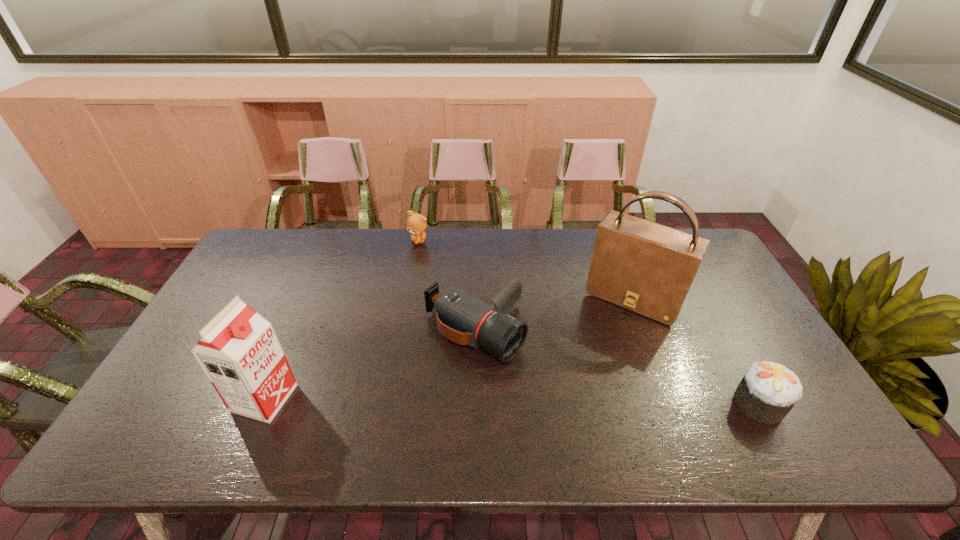
Locate an element on the screen. vacant space on the desktop that is between the soya milk and the rightmost object and is positioned on the face of the fourth object from right to left is located at coordinates (468, 400).

I want to click on vacant space on the desktop that is between the soya milk and the cupcake and is positioned on the lens of the third object from right to left, so click(584, 402).

At what (x,y) coordinates should I click in order to perform the action: click on vacant space on the desktop that is between the leftmost object and the rightmost object and is positioned on the front flap of the tallest object. Please return your answer as a coordinate pair (x, y). The width and height of the screenshot is (960, 540). Looking at the image, I should click on (574, 402).